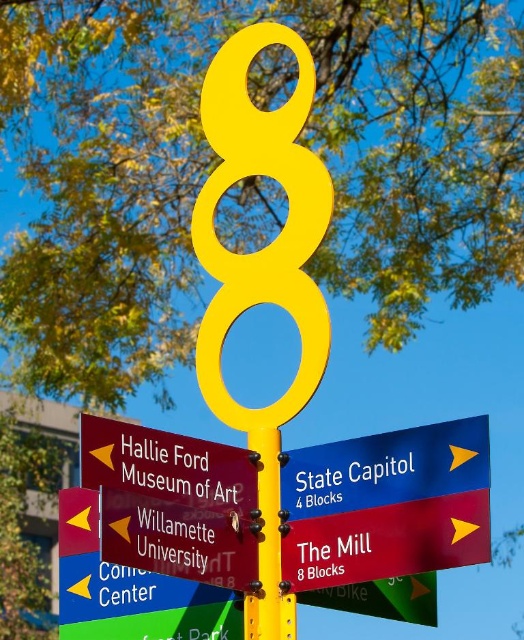
Question: Which point is closer to the camera taking this photo?

Choices:
 (A) (216, 577)
 (B) (278, 554)
 (C) (81, 452)

Answer: (C)

Question: Is the position of metallic red sign at center more distant than that of yellow matte pole at center?

Choices:
 (A) no
 (B) yes

Answer: (A)

Question: Is metallic red sign at center to the right of yellow matte pole at center from the viewer's perspective?

Choices:
 (A) no
 (B) yes

Answer: (A)

Question: Among these objects, which one is farthest from the camera?

Choices:
 (A) metallic red sign at center
 (B) yellow matte pole at center

Answer: (B)

Question: Which object appears farthest from the camera in this image?

Choices:
 (A) yellow matte pole at center
 (B) metallic red sign at center

Answer: (A)

Question: Can you confirm if metallic red sign at lower left is positioned to the right of yellow matte pole at center?

Choices:
 (A) yes
 (B) no

Answer: (B)